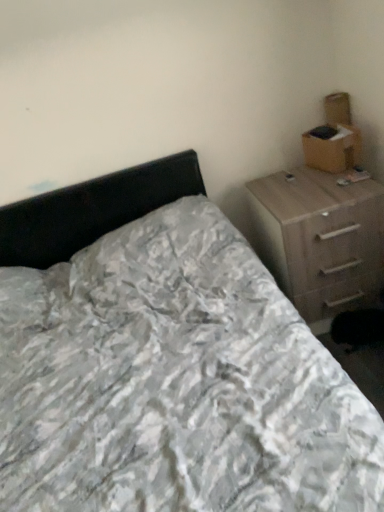
Question: Should I look upward or downward to see white textured bed at center?

Choices:
 (A) down
 (B) up

Answer: (A)

Question: Is white textured bed at center turned away from brown cardboard box at upper right?

Choices:
 (A) no
 (B) yes

Answer: (A)

Question: Does white textured bed at center have a smaller size compared to brown cardboard box at upper right?

Choices:
 (A) yes
 (B) no

Answer: (B)

Question: Is white textured bed at center next to brown cardboard box at upper right and touching it?

Choices:
 (A) no
 (B) yes

Answer: (A)

Question: Is white textured bed at center thinner than brown cardboard box at upper right?

Choices:
 (A) no
 (B) yes

Answer: (A)

Question: Is white textured bed at center completely or partially outside of brown cardboard box at upper right?

Choices:
 (A) yes
 (B) no

Answer: (A)

Question: From the image's perspective, is white textured bed at center below brown cardboard box at upper right?

Choices:
 (A) yes
 (B) no

Answer: (A)

Question: Would you say brown cardboard box at upper right is outside light brown wood chest of drawers at right?

Choices:
 (A) no
 (B) yes

Answer: (B)

Question: Is light brown wood chest of drawers at right inside brown cardboard box at upper right?

Choices:
 (A) no
 (B) yes

Answer: (A)

Question: Is brown cardboard box at upper right facing towards light brown wood chest of drawers at right?

Choices:
 (A) no
 (B) yes

Answer: (A)

Question: From the image's perspective, is brown cardboard box at upper right beneath light brown wood chest of drawers at right?

Choices:
 (A) yes
 (B) no

Answer: (B)

Question: From a real-world perspective, is brown cardboard box at upper right on light brown wood chest of drawers at right?

Choices:
 (A) no
 (B) yes

Answer: (B)

Question: Is brown cardboard box at upper right thinner than light brown wood chest of drawers at right?

Choices:
 (A) yes
 (B) no

Answer: (A)

Question: Is white textured bed at center facing away from light brown wood chest of drawers at right?

Choices:
 (A) no
 (B) yes

Answer: (A)